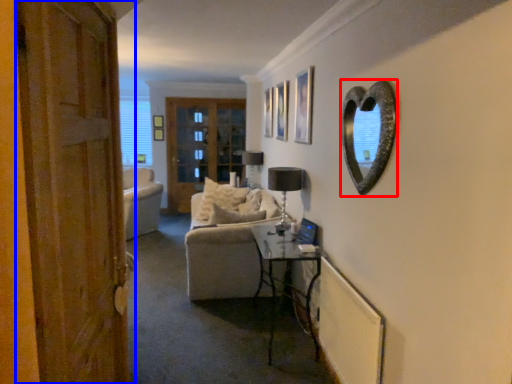
Question: Which of the following is the farthest to the observer, mirror (highlighted by a red box) or door (highlighted by a blue box)?

Choices:
 (A) mirror
 (B) door

Answer: (A)